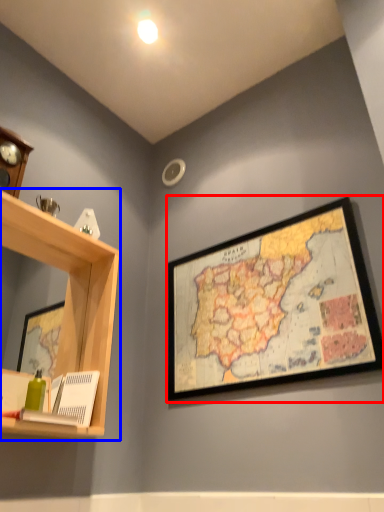
Question: Which point is further to the camera, picture frame (highlighted by a red box) or shelf (highlighted by a blue box)?

Choices:
 (A) picture frame
 (B) shelf

Answer: (A)